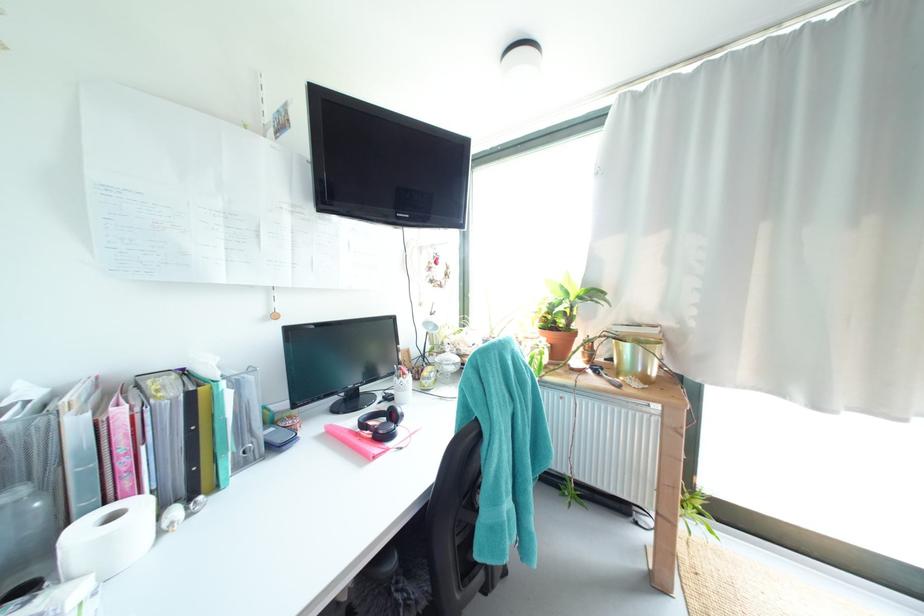
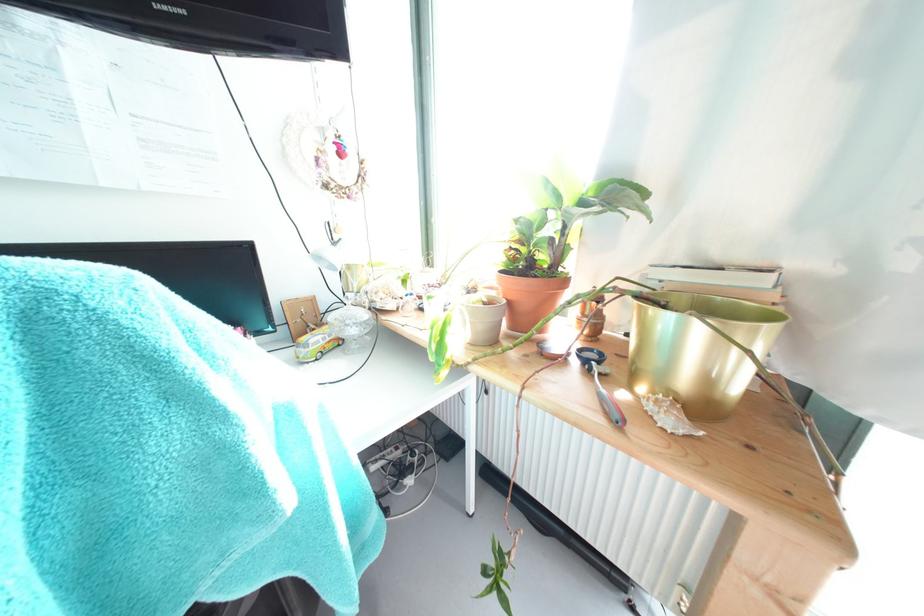
In a continuous first-person perspective shot, in which direction is the camera moving?

The cameraman walked toward right, forward.